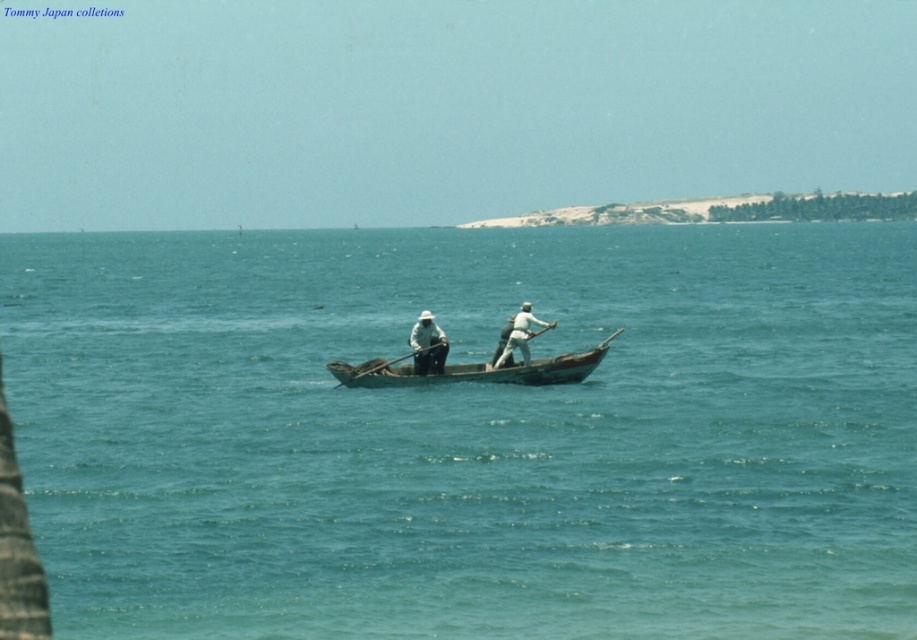
Question: Which point is farther from the camera taking this photo?

Choices:
 (A) click(520, 339)
 (B) click(583, 378)
 (C) click(94, 634)
 (D) click(429, 355)

Answer: (B)

Question: Is wooden canoe at center thinner than white matte hat at center?

Choices:
 (A) no
 (B) yes

Answer: (A)

Question: Among these objects, which one is farthest from the camera?

Choices:
 (A) light brown wooden paddle at center
 (B) wooden paddle at center
 (C) blue water at center

Answer: (A)

Question: Is blue water at center below light brown wooden paddle at center?

Choices:
 (A) yes
 (B) no

Answer: (B)

Question: Does light brown wooden paddle at center appear on the right side of wooden paddle at center?

Choices:
 (A) yes
 (B) no

Answer: (A)

Question: Which object is the closest to the wooden canoe at center?

Choices:
 (A) blue water at center
 (B) white matte hat at center
 (C) wooden paddle at center

Answer: (B)